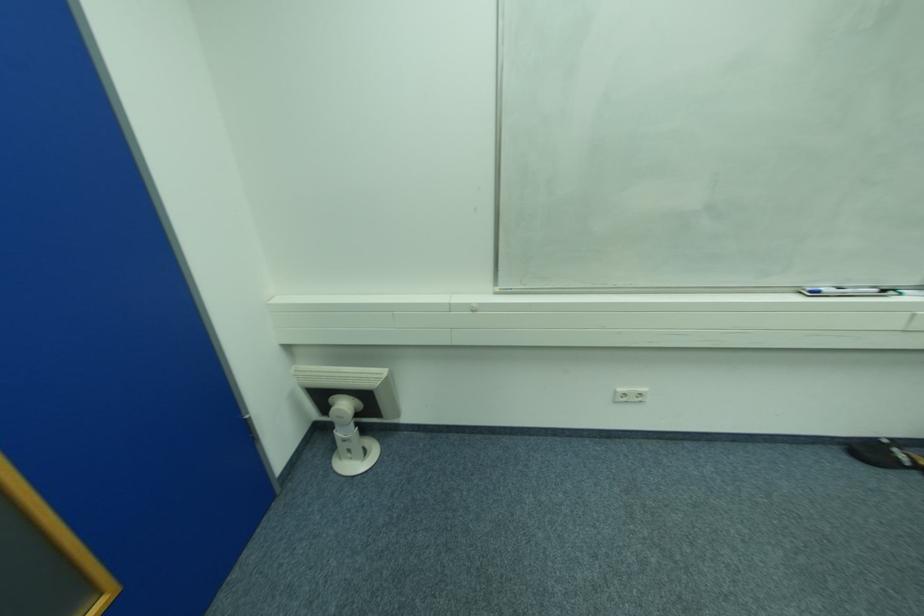
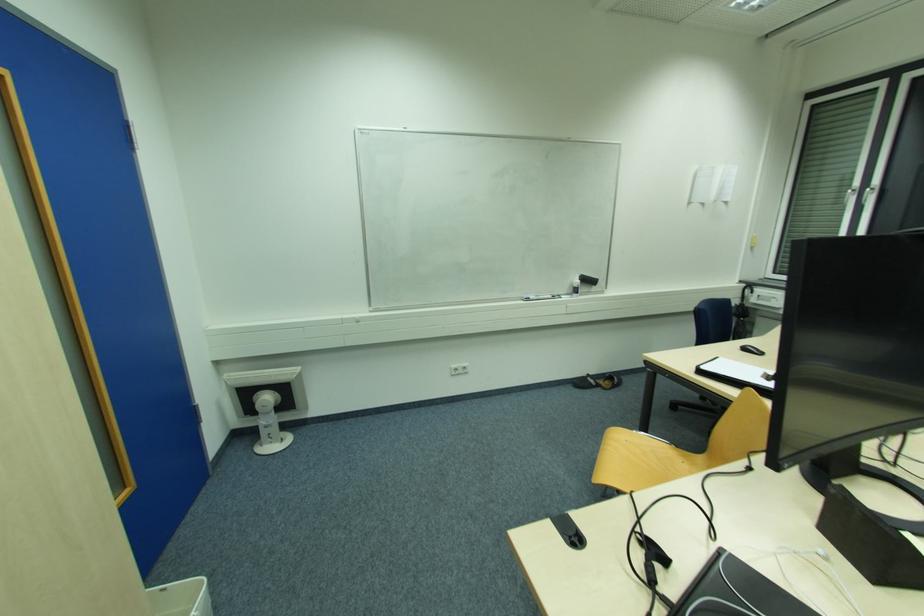
Question: What movement of the cameraman would produce the second image?

Choices:
 (A) Left
 (B) Right
 (C) Forward
 (D) Backward

Answer: (D)